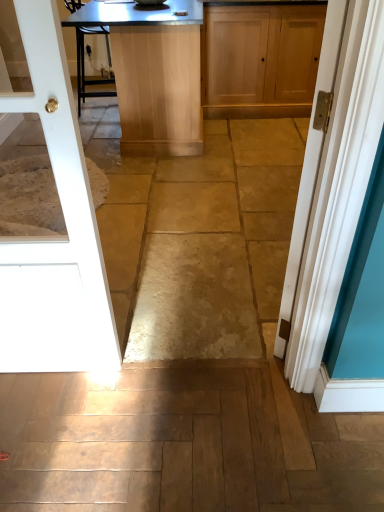
Question: Is matte wood cabinet at upper center directly adjacent to white painted wood door at right, positioned as the 2th door in left-to-right order?

Choices:
 (A) no
 (B) yes

Answer: (A)

Question: From a real-world perspective, is matte wood cabinet at upper center on top of white painted wood door at right, positioned as the 2th door in left-to-right order?

Choices:
 (A) no
 (B) yes

Answer: (A)

Question: Considering the relative sizes of matte wood cabinet at upper center and white painted wood door at right, positioned as the 2th door in left-to-right order, in the image provided, is matte wood cabinet at upper center shorter than white painted wood door at right, positioned as the 2th door in left-to-right order,?

Choices:
 (A) no
 (B) yes

Answer: (B)

Question: From the image's perspective, would you say matte wood cabinet at upper center is positioned over white painted wood door at right, marked as the first door in a right-to-left arrangement?

Choices:
 (A) no
 (B) yes

Answer: (B)

Question: Considering the relative sizes of matte wood cabinet at upper center and white painted wood door at right, marked as the first door in a right-to-left arrangement, in the image provided, is matte wood cabinet at upper center thinner than white painted wood door at right, marked as the first door in a right-to-left arrangement,?

Choices:
 (A) yes
 (B) no

Answer: (B)

Question: Considering the relative positions of matte wood cabinet at upper center and white painted wood door at right, positioned as the 2th door in left-to-right order, in the image provided, is matte wood cabinet at upper center to the right of white painted wood door at right, positioned as the 2th door in left-to-right order, from the viewer's perspective?

Choices:
 (A) no
 (B) yes

Answer: (B)

Question: Is light brown wooden table at center inside white glossy door at left, arranged as the first door when viewed from the left?

Choices:
 (A) yes
 (B) no

Answer: (B)

Question: Can you confirm if white glossy door at left, acting as the second door starting from the right, is thinner than light brown wooden table at center?

Choices:
 (A) no
 (B) yes

Answer: (B)

Question: Is white glossy door at left, arranged as the first door when viewed from the left, at the left side of light brown wooden table at center?

Choices:
 (A) yes
 (B) no

Answer: (A)

Question: Is white glossy door at left, arranged as the first door when viewed from the left, facing towards light brown wooden table at center?

Choices:
 (A) yes
 (B) no

Answer: (A)

Question: Can you confirm if white glossy door at left, acting as the second door starting from the right, is taller than light brown wooden table at center?

Choices:
 (A) no
 (B) yes

Answer: (B)

Question: Is white glossy door at left, acting as the second door starting from the right, positioned far away from light brown wooden table at center?

Choices:
 (A) yes
 (B) no

Answer: (A)

Question: From a real-world perspective, does white glossy door at left, arranged as the first door when viewed from the left, sit lower than matte wood cabinet at upper center?

Choices:
 (A) no
 (B) yes

Answer: (A)